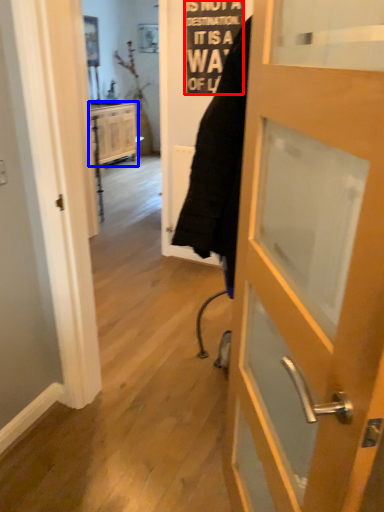
Question: Which object is further to the camera taking this photo, writing (highlighted by a red box) or cabinetry (highlighted by a blue box)?

Choices:
 (A) writing
 (B) cabinetry

Answer: (B)